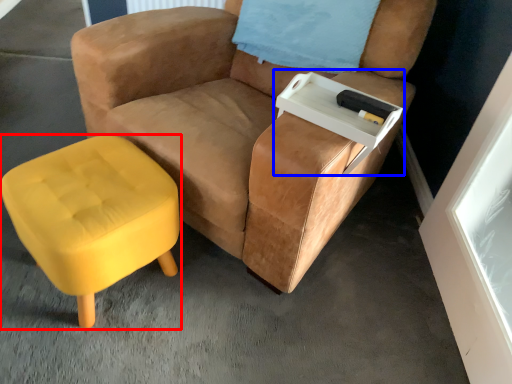
Question: Which object is further to the camera taking this photo, stool (highlighted by a red box) or side table (highlighted by a blue box)?

Choices:
 (A) stool
 (B) side table

Answer: (B)